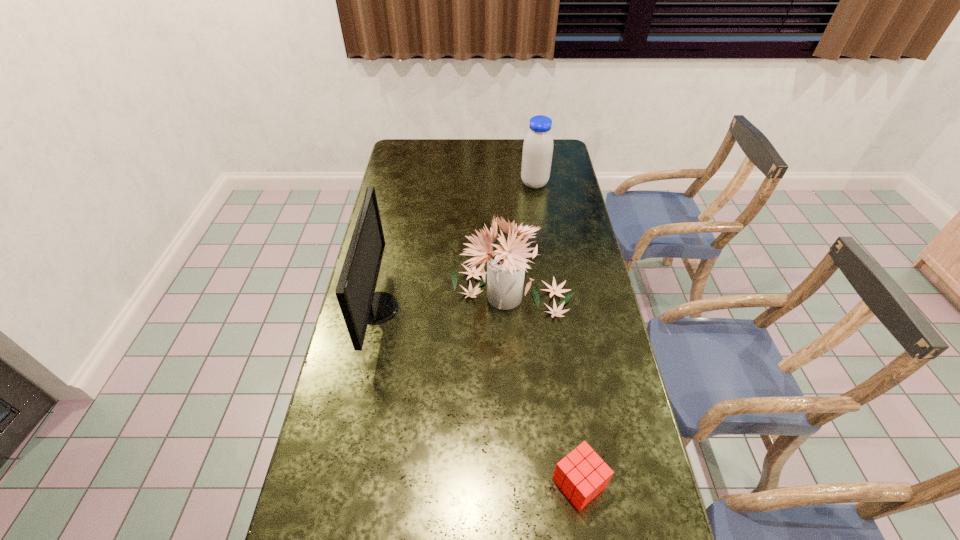
I want to click on bouquet that is at the right edge, so click(506, 264).

Identify the location of soya milk that is positioned at the right edge. (537, 153).

Find the location of `cube that is at the right edge`. cube that is at the right edge is located at coordinates (581, 475).

Find the location of a particular element. This screenshot has width=960, height=540. vacant space at the far edge of the desktop is located at coordinates (501, 150).

In the image, there is a desktop. Where is `vacant space at the left edge`? Image resolution: width=960 pixels, height=540 pixels. vacant space at the left edge is located at coordinates (384, 282).

This screenshot has height=540, width=960. In the image, there is a desktop. Identify the location of free region at the right edge. (572, 269).

This screenshot has width=960, height=540. Find the location of `free region at the far left corner`. free region at the far left corner is located at coordinates (408, 151).

Find the location of a particular element. vacant space at the far right corner is located at coordinates (555, 162).

Locate an element on the screen. The width and height of the screenshot is (960, 540). vacant region between the shortest object and the bouquet is located at coordinates (546, 388).

I want to click on vacant region between the nearest object and the bouquet, so click(x=546, y=388).